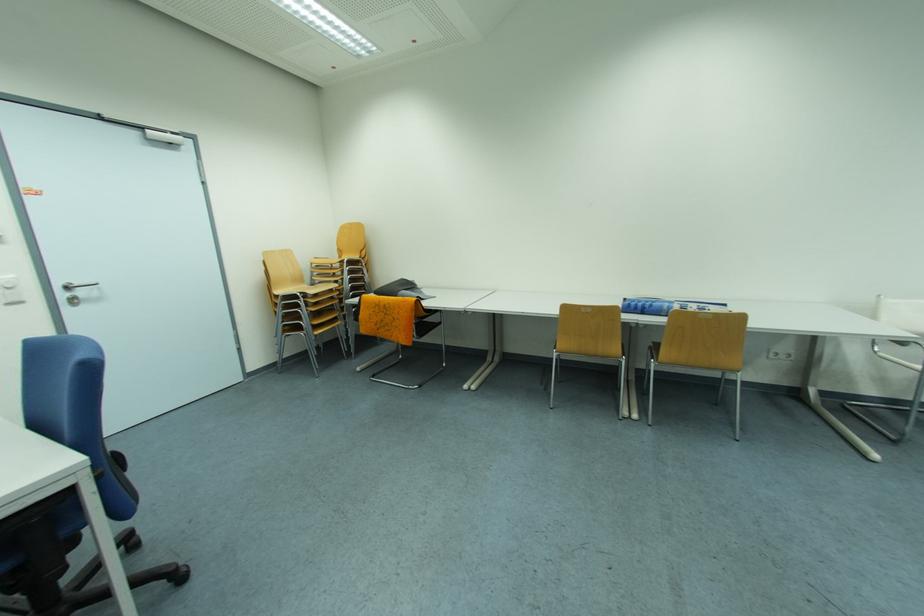
What do you see at coordinates (20, 464) in the screenshot? I see `a blue chair sitting surface` at bounding box center [20, 464].